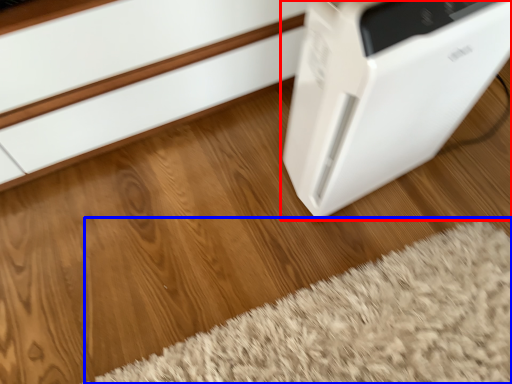
Question: Among these objects, which one is farthest to the camera, home appliance (highlighted by a red box) or doormat (highlighted by a blue box)?

Choices:
 (A) home appliance
 (B) doormat

Answer: (B)